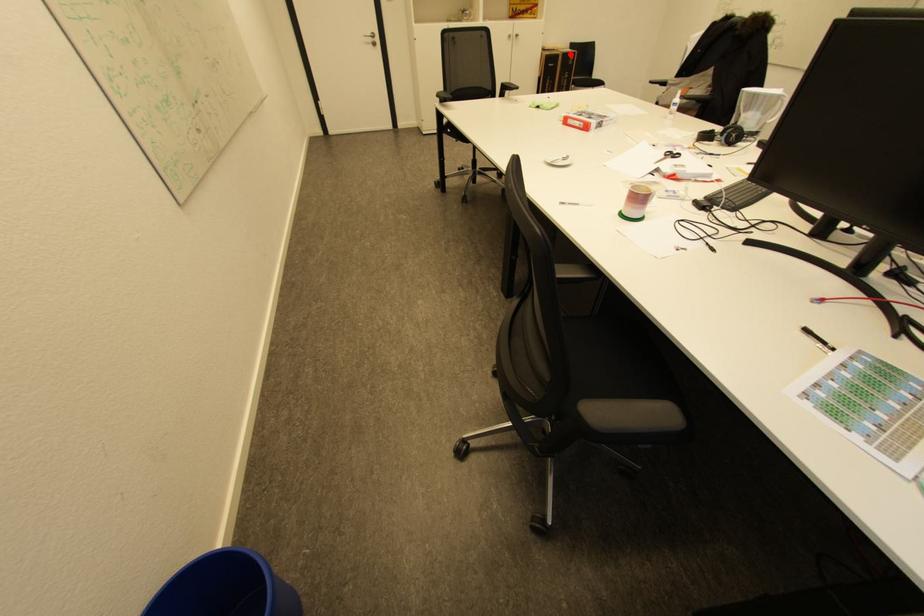
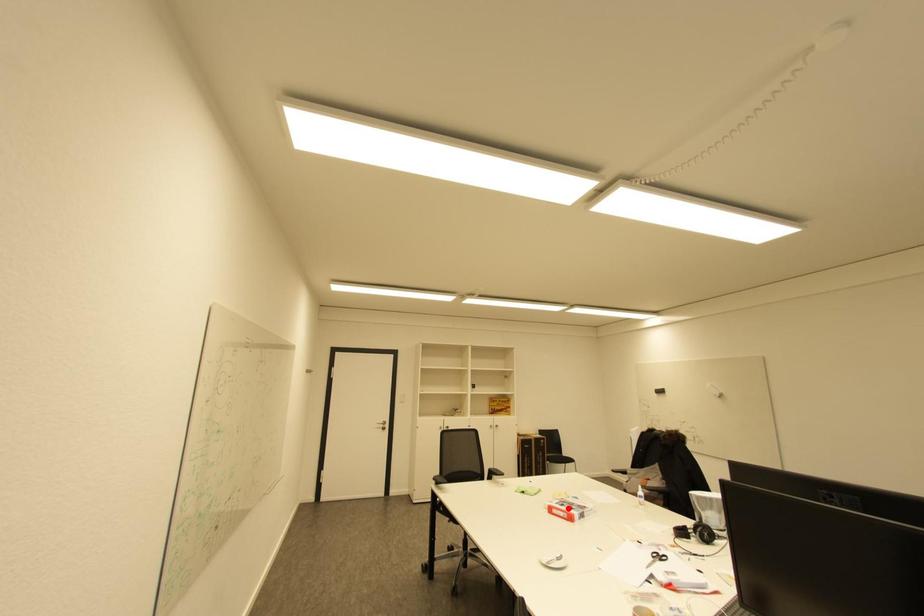
I am providing you with two images of the same scene from different viewpoints. A red point is marked on the first image and another point is marked on the second image. Is the red point in image1 aligned with the point shown in image2?

No